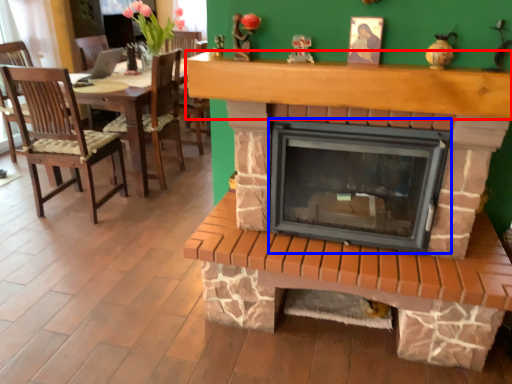
Question: Which object appears closest to the camera in this image, mantle (highlighted by a red box) or wood burning stove (highlighted by a blue box)?

Choices:
 (A) mantle
 (B) wood burning stove

Answer: (A)